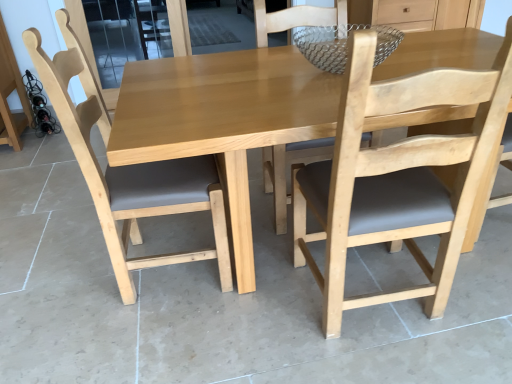
Question: Is natural wood table at center smaller than black matte wine bottles at left?

Choices:
 (A) yes
 (B) no

Answer: (B)

Question: Can you confirm if natural wood table at center is bigger than black matte wine bottles at left?

Choices:
 (A) yes
 (B) no

Answer: (A)

Question: From a real-world perspective, is natural wood table at center on black matte wine bottles at left?

Choices:
 (A) yes
 (B) no

Answer: (A)

Question: Does natural wood table at center have a lesser height compared to black matte wine bottles at left?

Choices:
 (A) yes
 (B) no

Answer: (B)

Question: From the image's perspective, is natural wood table at center below black matte wine bottles at left?

Choices:
 (A) no
 (B) yes

Answer: (B)

Question: Do you think light brown wood chair at center, which ranks as the 1th chair in right-to-left order, is within natural wood table at center, or outside of it?

Choices:
 (A) inside
 (B) outside

Answer: (A)

Question: Considering the positions of light brown wood chair at center, which is the 2th chair from left to right, and natural wood table at center in the image, is light brown wood chair at center, which is the 2th chair from left to right, wider or thinner than natural wood table at center?

Choices:
 (A) wide
 (B) thin

Answer: (B)

Question: Considering their positions, is light brown wood chair at center, which ranks as the 1th chair in right-to-left order, located in front of or behind natural wood table at center?

Choices:
 (A) front
 (B) behind

Answer: (A)

Question: In terms of height, does light brown wood chair at center, which is the 2th chair from left to right, look taller or shorter compared to natural wood table at center?

Choices:
 (A) tall
 (B) short

Answer: (A)

Question: Is natural wood table at center inside the boundaries of black matte wine bottles at left, or outside?

Choices:
 (A) outside
 (B) inside

Answer: (A)

Question: Considering their positions, is natural wood table at center located in front of or behind black matte wine bottles at left?

Choices:
 (A) behind
 (B) front

Answer: (B)

Question: Is point (388, 115) closer or farther from the camera than point (42, 110)?

Choices:
 (A) closer
 (B) farther

Answer: (A)

Question: Based on their sizes in the image, would you say natural wood table at center is bigger or smaller than black matte wine bottles at left?

Choices:
 (A) big
 (B) small

Answer: (A)

Question: Based on their positions, is light brown wood chair at center, placed as the first chair when sorted from left to right, located to the left or right of black matte wine bottles at left?

Choices:
 (A) left
 (B) right

Answer: (B)

Question: From their relative heights in the image, would you say light brown wood chair at center, acting as the 2th chair starting from the right, is taller or shorter than black matte wine bottles at left?

Choices:
 (A) short
 (B) tall

Answer: (B)